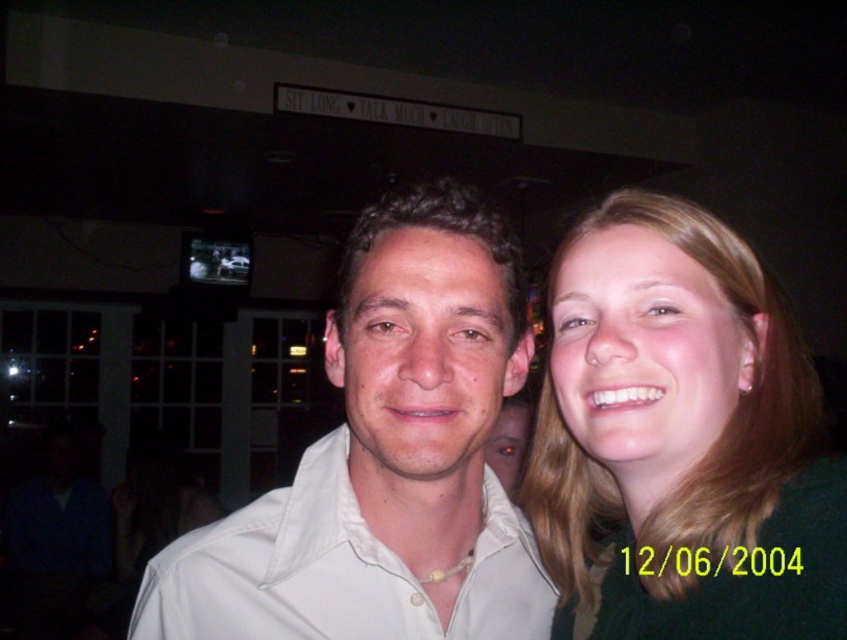
Question: Which point appears closest to the camera in this image?

Choices:
 (A) (350, 243)
 (B) (768, 374)

Answer: (B)

Question: Is blonde hair at center smaller than white satin shirt at center?

Choices:
 (A) no
 (B) yes

Answer: (A)

Question: Which is nearer to the white satin shirt at center?

Choices:
 (A) blonde hair at center
 (B) white matte shirt at center

Answer: (B)

Question: Can you confirm if blonde hair at center is positioned to the left of white satin shirt at center?

Choices:
 (A) yes
 (B) no

Answer: (B)

Question: Which point is farther to the camera?

Choices:
 (A) white satin shirt at center
 (B) blonde hair at center
 (C) white matte shirt at center

Answer: (A)

Question: Does white matte shirt at center appear on the left side of white satin shirt at center?

Choices:
 (A) no
 (B) yes

Answer: (A)